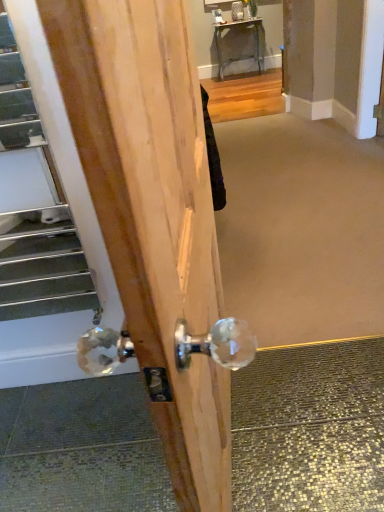
You are a GUI agent. You are given a task and a screenshot of the screen. Output one action in this format:
    pyautogui.click(x=<x>, y=<y>)
    Task: Click on the metallic silver escalator at lower left
    
    Given the screenshot: What is the action you would take?
    pyautogui.click(x=44, y=268)

What is the approximate width of metallic silver table at upper center?

metallic silver table at upper center is 16.46 inches wide.

Locate an element on the screen. This screenshot has height=512, width=384. metallic silver escalator at lower left is located at coordinates (44, 268).

Which of these two, metallic silver escalator at lower left or metallic silver table at upper center, is thinner?

metallic silver escalator at lower left.

From a real-world perspective, who is located higher, metallic silver escalator at lower left or metallic silver table at upper center?

In real-world perspective, metallic silver escalator at lower left is above.

Does metallic silver escalator at lower left appear on the left side of metallic silver table at upper center?

Indeed, metallic silver escalator at lower left is positioned on the left side of metallic silver table at upper center.

Are metallic silver escalator at lower left and metallic silver table at upper center far apart?

Absolutely, metallic silver escalator at lower left is distant from metallic silver table at upper center.

Which point is more distant from viewer, (172, 416) or (257, 40)?

The point (257, 40) is more distant.

Relative to metallic silver table at upper center, is clear crystal doorknob at center in front or behind?

Clearly, clear crystal doorknob at center is in front of metallic silver table at upper center.

Is metallic silver table at upper center at the back of clear crystal doorknob at center?

Yes, clear crystal doorknob at center is positioned with its back facing metallic silver table at upper center.

Considering the relative sizes of clear crystal doorknob at center and metallic silver table at upper center in the image provided, is clear crystal doorknob at center taller than metallic silver table at upper center?

Yes, clear crystal doorknob at center is taller than metallic silver table at upper center.

Do you think clear crystal doorknob at center is within metallic silver escalator at lower left, or outside of it?

clear crystal doorknob at center cannot be found inside metallic silver escalator at lower left.

Is clear crystal doorknob at center far from metallic silver escalator at lower left?

No, there isn't a large distance between clear crystal doorknob at center and metallic silver escalator at lower left.

How far apart are clear crystal doorknob at center and metallic silver escalator at lower left?

clear crystal doorknob at center is 27.57 inches away from metallic silver escalator at lower left.

From the image's perspective, between clear crystal doorknob at center and metallic silver escalator at lower left, who is located below?

clear crystal doorknob at center.

Is metallic silver table at upper center inside or outside of metallic silver escalator at lower left?

metallic silver table at upper center is spatially situated outside metallic silver escalator at lower left.

Measure the distance between metallic silver table at upper center and metallic silver escalator at lower left.

metallic silver table at upper center and metallic silver escalator at lower left are 4.23 meters apart.

How many degrees apart are the facing directions of metallic silver table at upper center and metallic silver escalator at lower left?

They differ by 0.625 degrees in their facing directions.

At what (x,y) coordinates should I click in order to perform the action: click on escalator in front of the metallic silver table at upper center. Please return your answer as a coordinate pair (x, y). Looking at the image, I should click on (44, 268).

Which is in front, point (237, 59) or point (146, 106)?

The point (146, 106) is in front.

Where is `door in front of the metallic silver table at upper center`? This screenshot has height=512, width=384. door in front of the metallic silver table at upper center is located at coordinates (156, 221).

Can you confirm if metallic silver table at upper center is shorter than clear crystal doorknob at center?

Indeed, metallic silver table at upper center has a lesser height compared to clear crystal doorknob at center.

Is metallic silver table at upper center inside or outside of clear crystal doorknob at center?

metallic silver table at upper center cannot be found inside clear crystal doorknob at center.

Is clear crystal doorknob at center located within metallic silver escalator at lower left?

That's incorrect, clear crystal doorknob at center is not inside metallic silver escalator at lower left.

What's the angular difference between metallic silver escalator at lower left and clear crystal doorknob at center's facing directions?

The facing directions of metallic silver escalator at lower left and clear crystal doorknob at center are 7.33 degrees apart.

Is metallic silver escalator at lower left thinner than clear crystal doorknob at center?

Yes, metallic silver escalator at lower left is thinner than clear crystal doorknob at center.

Image resolution: width=384 pixels, height=512 pixels. What are the coordinates of `escalator in front of the metallic silver table at upper center` in the screenshot? It's located at (44, 268).

The height and width of the screenshot is (512, 384). Find the location of `table below the clear crystal doorknob at center (from a real-world perspective)`. table below the clear crystal doorknob at center (from a real-world perspective) is located at coordinates (240, 55).

From the picture: From the image, which object appears to be nearer to clear crystal doorknob at center, metallic silver table at upper center or metallic silver escalator at lower left?

The object closer to clear crystal doorknob at center is metallic silver escalator at lower left.

Based on their spatial positions, is clear crystal doorknob at center or metallic silver escalator at lower left closer to metallic silver table at upper center?

metallic silver escalator at lower left lies closer to metallic silver table at upper center than the other object.

Based on their spatial positions, is metallic silver escalator at lower left or clear crystal doorknob at center further from metallic silver table at upper center?

Among the two, clear crystal doorknob at center is located further to metallic silver table at upper center.

When comparing their distances from clear crystal doorknob at center, does metallic silver escalator at lower left or metallic silver table at upper center seem further?

metallic silver table at upper center is positioned further to the anchor clear crystal doorknob at center.

Based on their spatial positions, is metallic silver table at upper center or clear crystal doorknob at center further from metallic silver escalator at lower left?

The object further to metallic silver escalator at lower left is metallic silver table at upper center.

Estimate the real-world distances between objects in this image. Which object is closer to metallic silver escalator at lower left, clear crystal doorknob at center or metallic silver table at upper center?

clear crystal doorknob at center.

Where is `escalator located between clear crystal doorknob at center and metallic silver table at upper center in the depth direction`? The height and width of the screenshot is (512, 384). escalator located between clear crystal doorknob at center and metallic silver table at upper center in the depth direction is located at coordinates (44, 268).